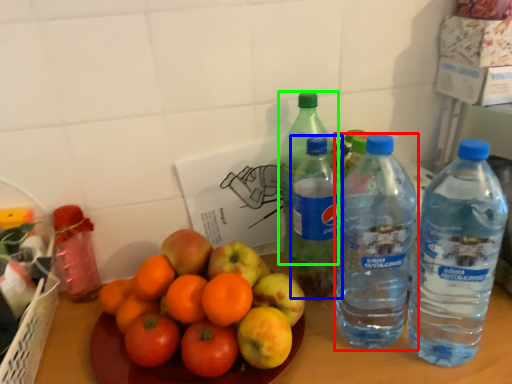
Question: Based on their relative distances, which object is nearer to bottle (highlighted by a red box)? Choose from bottle (highlighted by a blue box) and bottle (highlighted by a green box).

Choices:
 (A) bottle
 (B) bottle

Answer: (A)